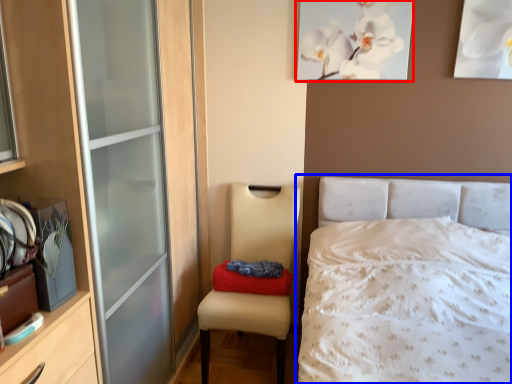
Question: Which object is closer to the camera taking this photo, picture frame (highlighted by a red box) or bed (highlighted by a blue box)?

Choices:
 (A) picture frame
 (B) bed

Answer: (B)